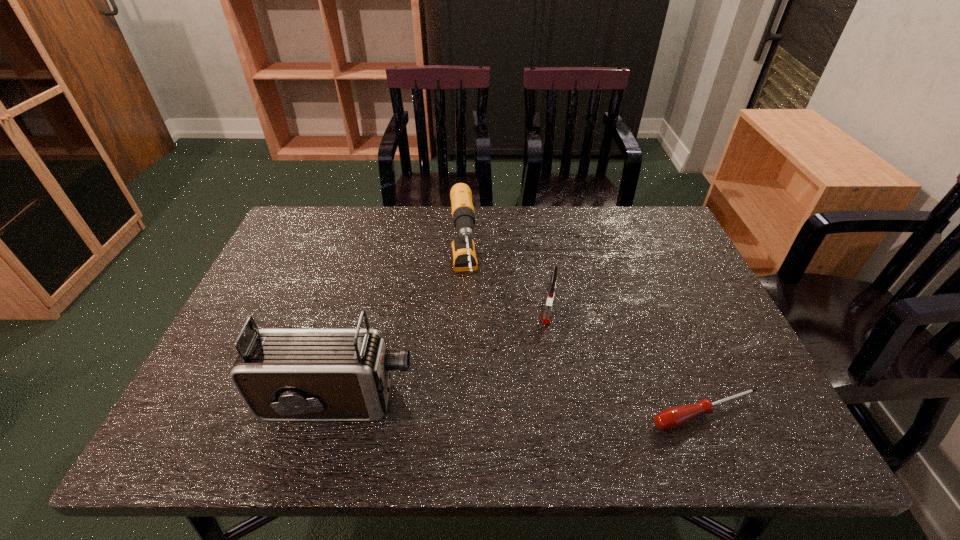
Locate an element on the screen. The image size is (960, 540). free space on the desktop that is between the leftmost object and the screwdriver and is positioned on the handle side of the third object from left to right is located at coordinates (531, 407).

Find the location of a particular element. Image resolution: width=960 pixels, height=540 pixels. free space on the desktop that is between the camcorder and the rightmost object and is positioned on the handle side of the third object from right to left is located at coordinates (477, 406).